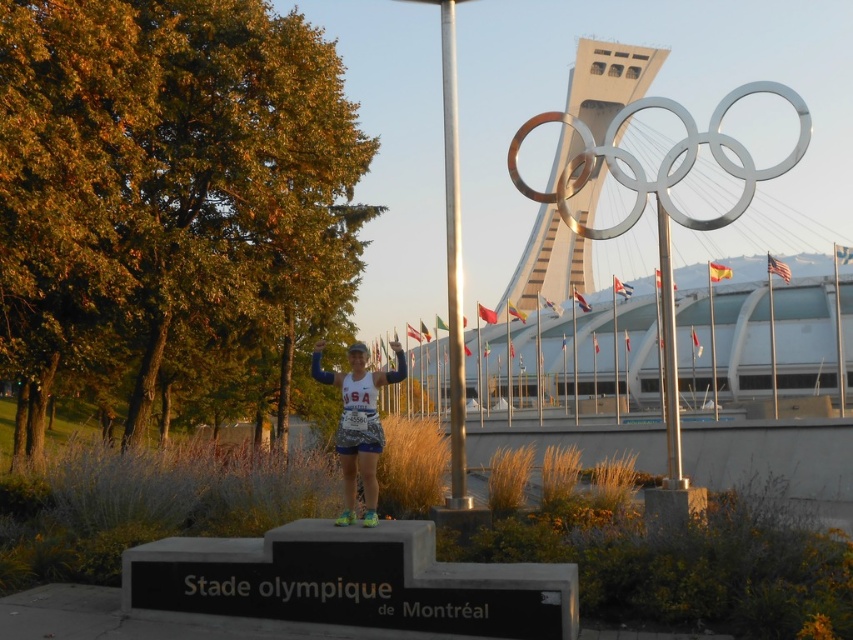
You are a photographer at the Stade Olympique de Montral. You need to take a photo of the camouflage fabric running suit at center and the metallic pole at center. Which object should be placed closer to the camera to ensure both are in focus?

The metallic pole at center is positioned over camouflage fabric running suit at center, so to ensure both are in focus, the metallic pole at center should be placed closer to the camera.

You are a photographer standing at the edge of the field. You want to take a photo of the metallic pole at center and the camouflage fabric running suit at center so that both are clearly visible in the frame. Given that your camera has a maximum focus range of 8 feet, will you be able to capture both objects in focus?

The metallic pole at center is 8.60 feet from the camouflage fabric running suit at center. Since the distance between them exceeds the camera maximum focus range of 8 feet, you won

You are a photographer at the Stade Olympique de Montr?al. You want to take a photo of the camouflage fabric running suit at center and the silver metallic pole at upper center so that the pole appears directly above the suit in the frame. Is this possible based on their current positions?

The camouflage fabric running suit at center is positioned under the silver metallic pole at upper center, so yes, the pole will appear directly above the suit in the photo.